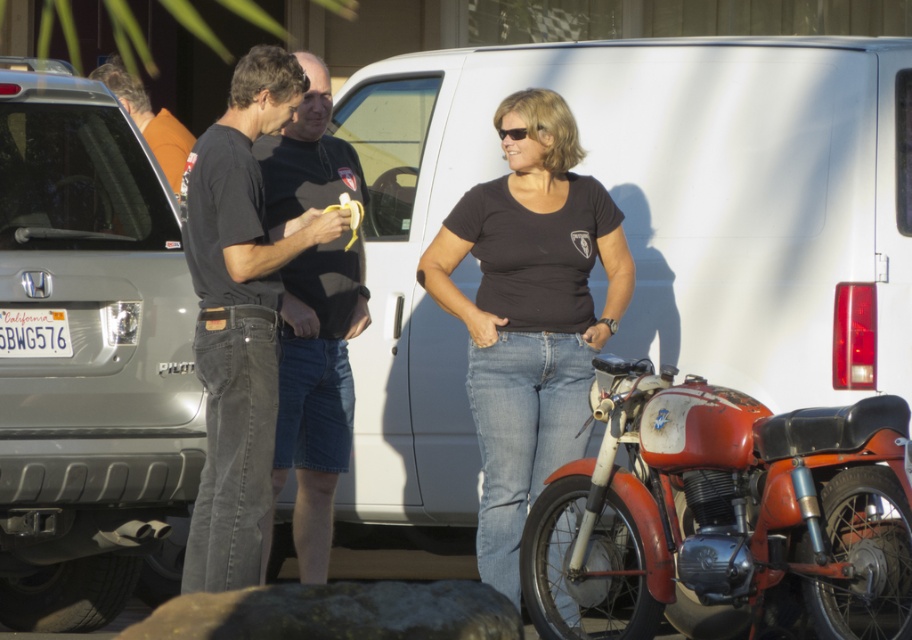
Can you confirm if rusty metal motorcycle at lower right is shorter than black cotton shirt at center?

Correct, rusty metal motorcycle at lower right is not as tall as black cotton shirt at center.

Who is taller, rusty metal motorcycle at lower right or black cotton shirt at center?

With more height is black cotton shirt at center.

Is point (628, 532) positioned behind point (245, 106)?

No, (628, 532) is in front of (245, 106).

Locate an element on the screen. The height and width of the screenshot is (640, 912). rusty metal motorcycle at lower right is located at coordinates (714, 509).

Is silver metallic minivan at left positioned at the back of rusty metal motorcycle at lower right?

Yes.

Can you confirm if silver metallic minivan at left is taller than rusty metal motorcycle at lower right?

Correct, silver metallic minivan at left is much taller as rusty metal motorcycle at lower right.

Identify the location of silver metallic minivan at left. This screenshot has width=912, height=640. (88, 353).

At what (x,y) coordinates should I click in order to perform the action: click on silver metallic minivan at left. Please return your answer as a coordinate pair (x, y). The width and height of the screenshot is (912, 640). Looking at the image, I should click on (88, 353).

Does rusty metal motorcycle at lower right come in front of white plastic license plate at center?

Yes, rusty metal motorcycle at lower right is closer to the viewer.

Between point (728, 486) and point (40, 317), which one is positioned in front?

Point (728, 486) is in front.

You are a GUI agent. You are given a task and a screenshot of the screen. Output one action in this format:
    pyautogui.click(x=<x>, y=<y>)
    Task: Click on the rusty metal motorcycle at lower right
    The height and width of the screenshot is (640, 912).
    Given the screenshot: What is the action you would take?
    pyautogui.click(x=714, y=509)